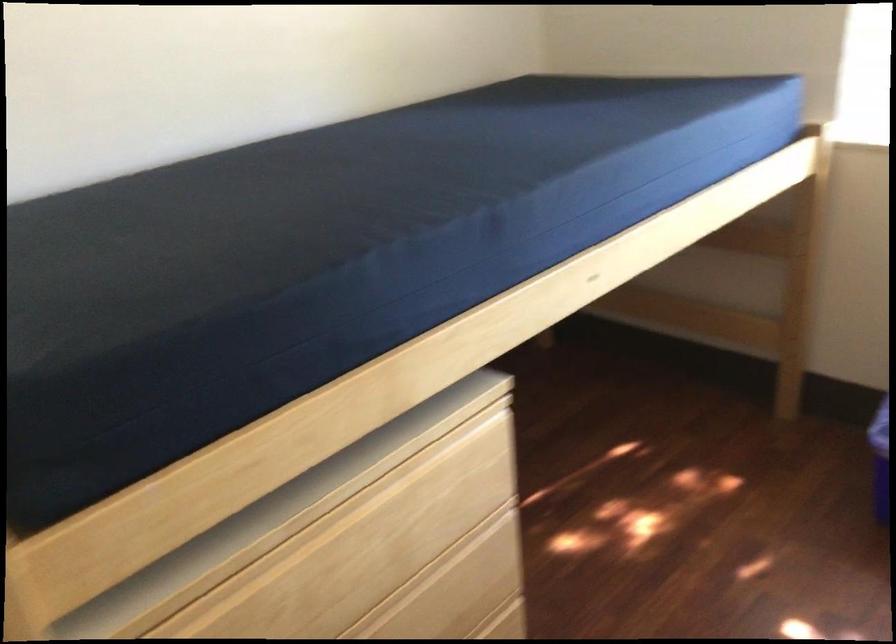
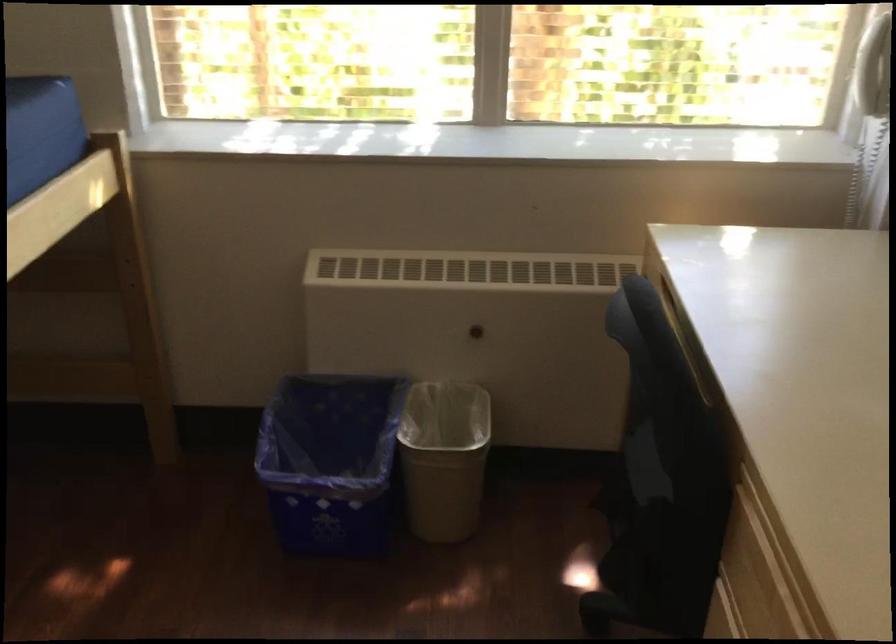
Question: The camera is either moving clockwise (left) or counter-clockwise (right) around the object. The first image is from the beginning of the video and the second image is from the end. Is the camera moving left or right when shooting the video?

Choices:
 (A) Left
 (B) Right

Answer: (A)